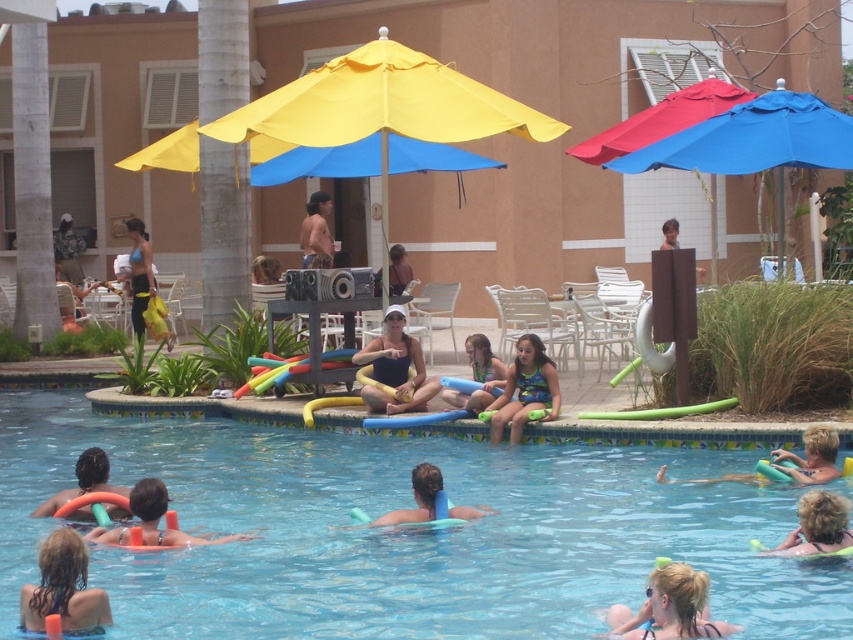
Which is more to the right, blonde hair swim cap at lower right or matte yellow shorts at left?

Positioned to the right is blonde hair swim cap at lower right.

Who is more distant from viewer, (689,593) or (146,280)?

Point (146,280)

Where is `blonde hair swim cap at lower right`? This screenshot has width=853, height=640. blonde hair swim cap at lower right is located at coordinates (670, 608).

Does blonde hair swim cap at lower right come behind brown leather jacket at upper center?

No, it is in front of brown leather jacket at upper center.

Between blonde hair swim cap at lower right and brown leather jacket at upper center, which one appears on the left side from the viewer's perspective?

brown leather jacket at upper center

The width and height of the screenshot is (853, 640). What do you see at coordinates (670, 608) in the screenshot?
I see `blonde hair swim cap at lower right` at bounding box center [670, 608].

The image size is (853, 640). I want to click on blonde hair swim cap at lower right, so click(x=670, y=608).

Does matte blue swimsuit at center have a lesser height compared to shiny brown hair at upper center?

Indeed, matte blue swimsuit at center has a lesser height compared to shiny brown hair at upper center.

Does matte blue swimsuit at center have a greater width compared to shiny brown hair at upper center?

No.

Image resolution: width=853 pixels, height=640 pixels. Describe the element at coordinates (395, 369) in the screenshot. I see `matte blue swimsuit at center` at that location.

This screenshot has width=853, height=640. What are the coordinates of `matte blue swimsuit at center` in the screenshot? It's located at (395, 369).